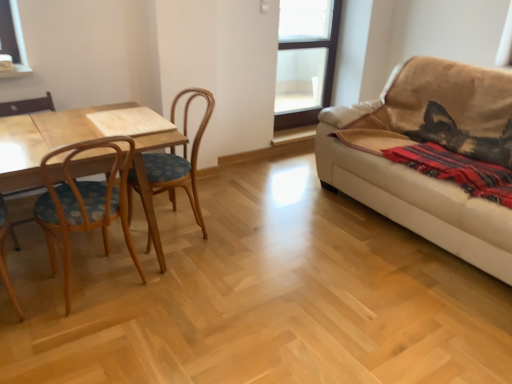
At what (x,y) coordinates should I click in order to perform the action: click on free space that is in between wooden chair at left and beige fabric couch at right. Please return your answer as a coordinate pair (x, y). Looking at the image, I should click on pyautogui.click(x=293, y=259).